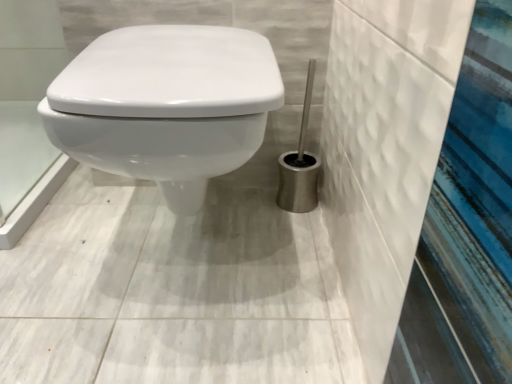
Where is `vacant space to the left of white glossy toilet at center`? vacant space to the left of white glossy toilet at center is located at coordinates (60, 244).